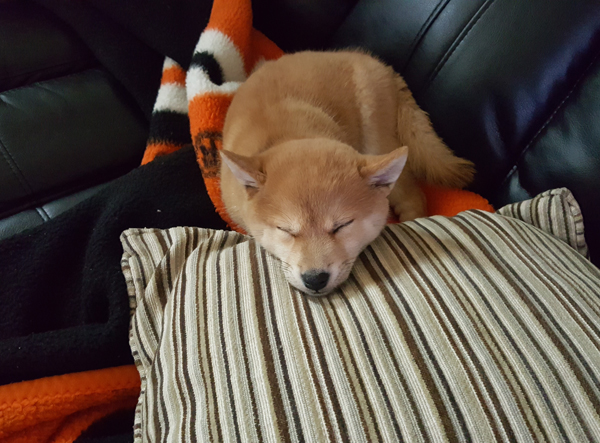
Identify the location of cushion. (416, 263).